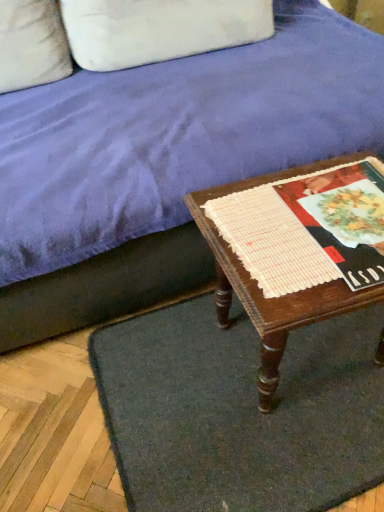
Question: Does white fabric pillow at upper left have a greater height compared to velvet purple couch at upper center?

Choices:
 (A) yes
 (B) no

Answer: (B)

Question: Does white fabric pillow at upper left lie behind velvet purple couch at upper center?

Choices:
 (A) no
 (B) yes

Answer: (B)

Question: From a real-world perspective, is white fabric pillow at upper left positioned under velvet purple couch at upper center based on gravity?

Choices:
 (A) yes
 (B) no

Answer: (B)

Question: Does white fabric pillow at upper left appear on the left side of velvet purple couch at upper center?

Choices:
 (A) yes
 (B) no

Answer: (A)

Question: From the image's perspective, would you say white fabric pillow at upper left is shown under velvet purple couch at upper center?

Choices:
 (A) yes
 (B) no

Answer: (B)

Question: Is white fabric pillow at upper left to the right of velvet purple couch at upper center from the viewer's perspective?

Choices:
 (A) no
 (B) yes

Answer: (A)

Question: Can you confirm if dark gray carpet at lower center is smaller than velvet purple couch at upper center?

Choices:
 (A) no
 (B) yes

Answer: (B)

Question: From the image's perspective, is dark gray carpet at lower center on velvet purple couch at upper center?

Choices:
 (A) yes
 (B) no

Answer: (B)

Question: Considering the relative sizes of dark gray carpet at lower center and velvet purple couch at upper center in the image provided, is dark gray carpet at lower center taller than velvet purple couch at upper center?

Choices:
 (A) no
 (B) yes

Answer: (A)

Question: From a real-world perspective, is dark gray carpet at lower center below velvet purple couch at upper center?

Choices:
 (A) yes
 (B) no

Answer: (A)

Question: Can you confirm if dark gray carpet at lower center is positioned to the right of velvet purple couch at upper center?

Choices:
 (A) yes
 (B) no

Answer: (A)

Question: Is dark gray carpet at lower center to the left of velvet purple couch at upper center from the viewer's perspective?

Choices:
 (A) yes
 (B) no

Answer: (B)

Question: Is white woven placemat at center completely or partially inside wooden table at lower right?

Choices:
 (A) no
 (B) yes

Answer: (B)